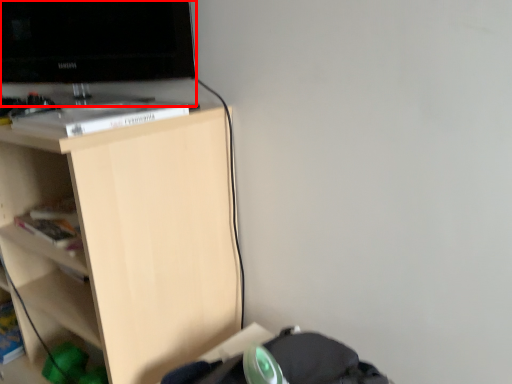
Question: From the image's perspective, where is television (annotated by the red box) located in relation to shelf in the image?

Choices:
 (A) above
 (B) below

Answer: (A)